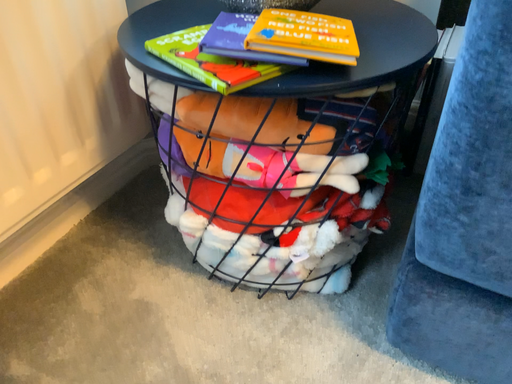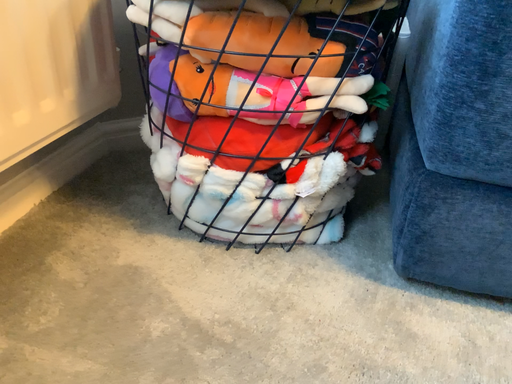
Question: How did the camera likely rotate when shooting the video?

Choices:
 (A) rotated right
 (B) rotated left

Answer: (A)